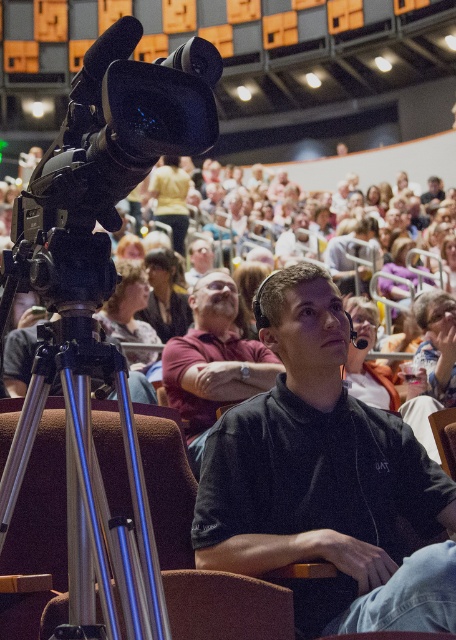
Question: Is black matte shirt at center bigger than dark red shirt at center?

Choices:
 (A) yes
 (B) no

Answer: (B)

Question: Is black matte shirt at center thinner than silver metallic tripod at left?

Choices:
 (A) no
 (B) yes

Answer: (B)

Question: Which of the following is the farthest from the observer?

Choices:
 (A) (169, 275)
 (B) (103, 348)

Answer: (A)

Question: Which point appears farthest from the camera in this image?

Choices:
 (A) (171, 269)
 (B) (383, 499)
 (C) (210, 326)

Answer: (A)

Question: Estimate the real-world distances between objects in this image. Which object is closer to the black matte shirt at center?

Choices:
 (A) dark brown hair at center
 (B) dark red shirt at center
 (C) silver metallic tripod at left

Answer: (C)

Question: Can you confirm if black matte shirt at center is positioned to the left of dark red shirt at center?

Choices:
 (A) no
 (B) yes

Answer: (A)